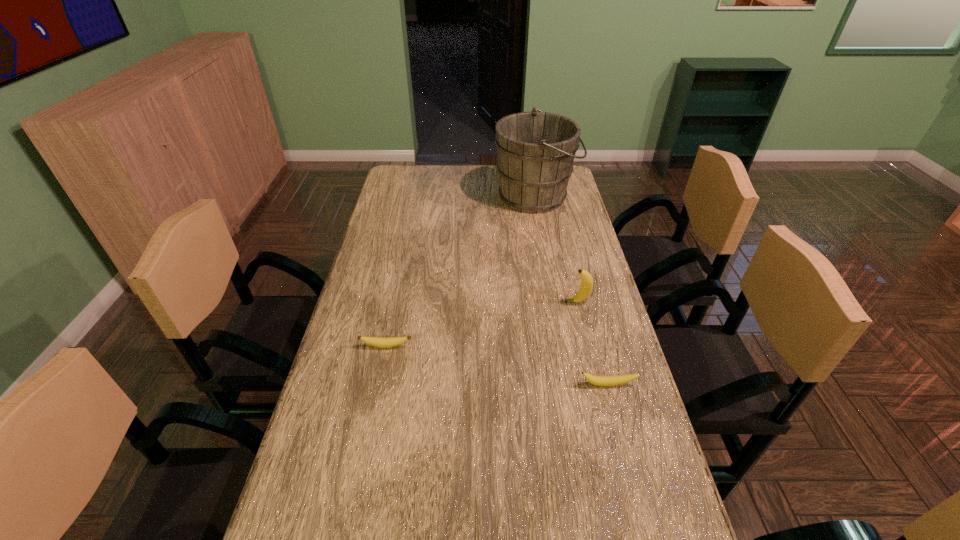
Where is `the farthest object`? the farthest object is located at coordinates (536, 150).

What are the coordinates of `the tallest object` in the screenshot? It's located at (536, 150).

Where is `the third shortest object`? This screenshot has width=960, height=540. the third shortest object is located at coordinates (586, 287).

Where is `the second farthest object`? This screenshot has height=540, width=960. the second farthest object is located at coordinates (586, 287).

At what (x,y) coordinates should I click in order to perform the action: click on the nearest banana. Please return your answer as a coordinate pair (x, y). The height and width of the screenshot is (540, 960). Looking at the image, I should click on (595, 380).

I want to click on the nearest object, so click(595, 380).

I want to click on the shortest object, so click(381, 342).

Locate an element on the screen. the third farthest object is located at coordinates (381, 342).

The image size is (960, 540). Identify the location of free region located from the stem of the farthest banana. (528, 302).

The image size is (960, 540). In order to click on vacant space located from the stem of the farthest banana in this screenshot , I will do `click(446, 302)`.